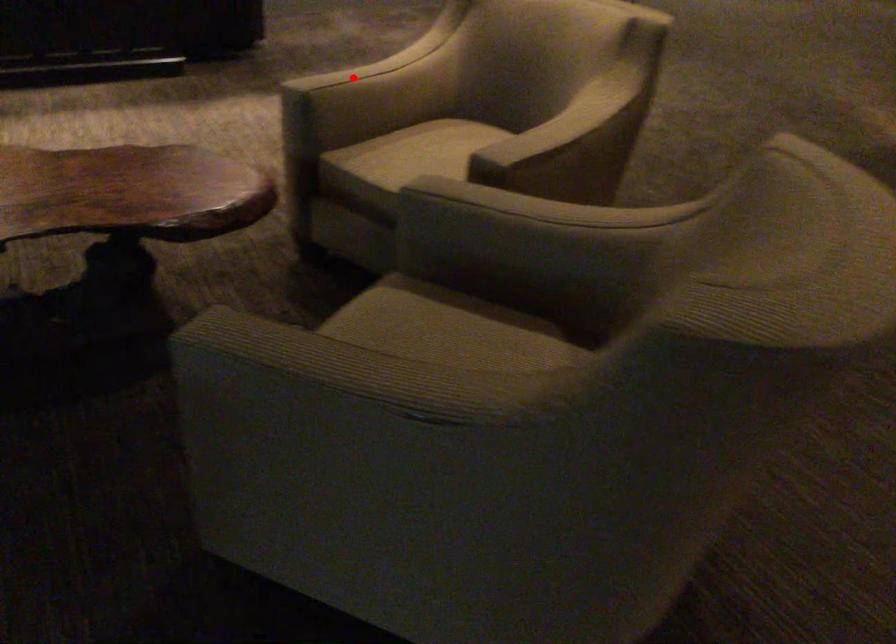
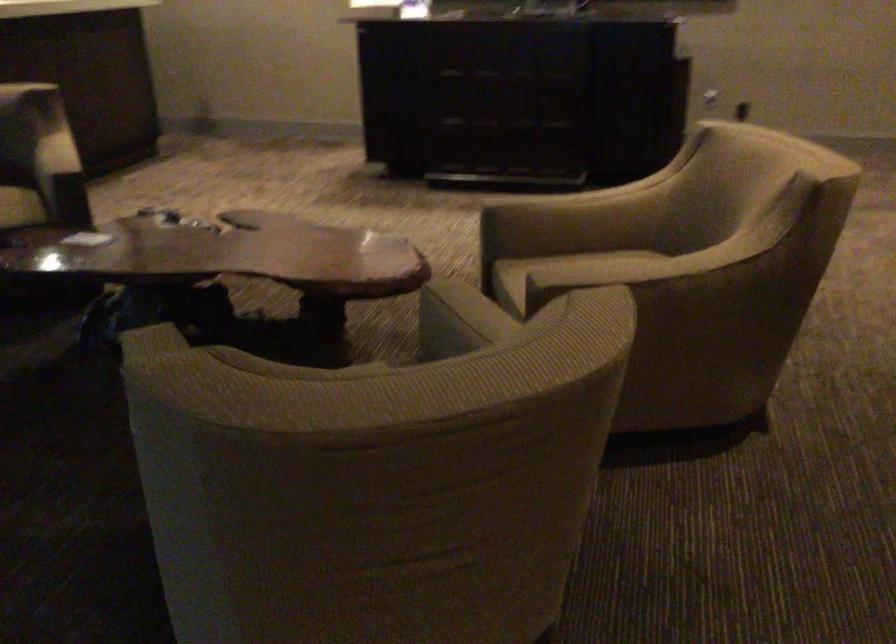
Question: A red point is marked in image1. In image2, is the corresponding 3D point closer to the camera or farther? Reply with the corresponding letter.

Choices:
 (A) The corresponding 3D point is closer.
 (B) The corresponding 3D point is farther.

Answer: (B)